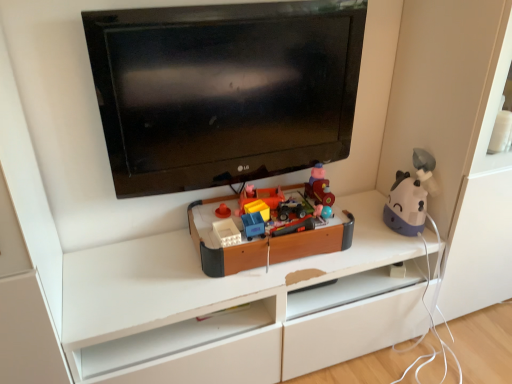
At what (x,y) coordinates should I click in order to perform the action: click on vacant region above wooden toy box at center, which is the third toy from right to left (from a real-world perspective). Please return your answer as a coordinate pair (x, y). This screenshot has width=512, height=384. Looking at the image, I should click on (272, 215).